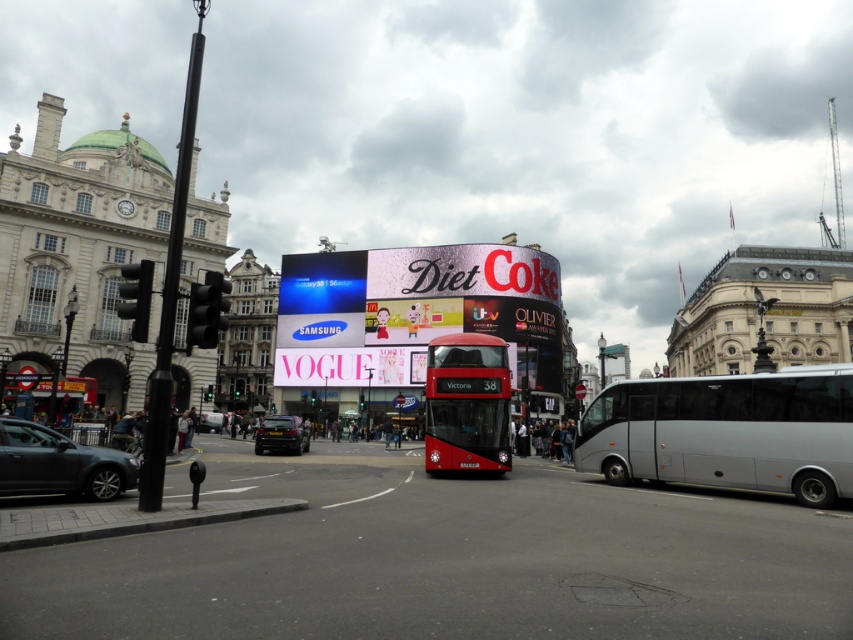
Looking at this image, which of these two, silver metallic bus at right or red matte bus at center, stands shorter?

With less height is silver metallic bus at right.

Who is more forward, (734, 460) or (483, 365)?

Point (734, 460) is more forward.

Which is in front, point (759, 387) or point (482, 401)?

Point (759, 387) is more forward.

At what (x,y) coordinates should I click in order to perform the action: click on silver metallic bus at right. Please return your answer as a coordinate pair (x, y). Image resolution: width=853 pixels, height=640 pixels. Looking at the image, I should click on (727, 433).

Between matte black car at lower left and shiny black car at center, which one appears on the right side from the viewer's perspective?

shiny black car at center is more to the right.

Is matte black car at lower left positioned before shiny black car at center?

Yes, it is.

Does point (61, 440) lie behind point (292, 417)?

No, (61, 440) is in front of (292, 417).

This screenshot has width=853, height=640. In order to click on matte black car at lower left in this screenshot , I will do point(59,464).

Who is taller, silver metallic bus at right or shiny black car at center?

Standing taller between the two is silver metallic bus at right.

Does silver metallic bus at right have a greater height compared to shiny black car at center?

Indeed, silver metallic bus at right has a greater height compared to shiny black car at center.

Who is more forward, [674,390] or [273,432]?

Point [674,390] is in front.

I want to click on silver metallic bus at right, so pos(727,433).